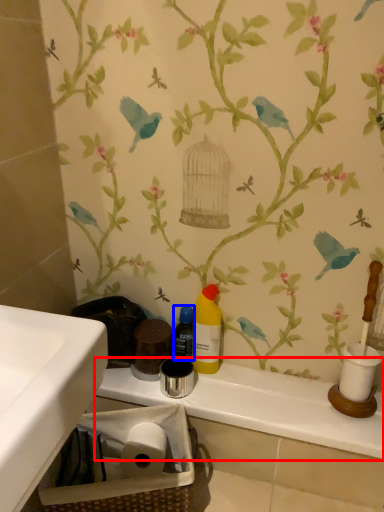
Question: Which object is closer to the camera taking this photo, counter top (highlighted by a red box) or bottle (highlighted by a blue box)?

Choices:
 (A) counter top
 (B) bottle

Answer: (A)